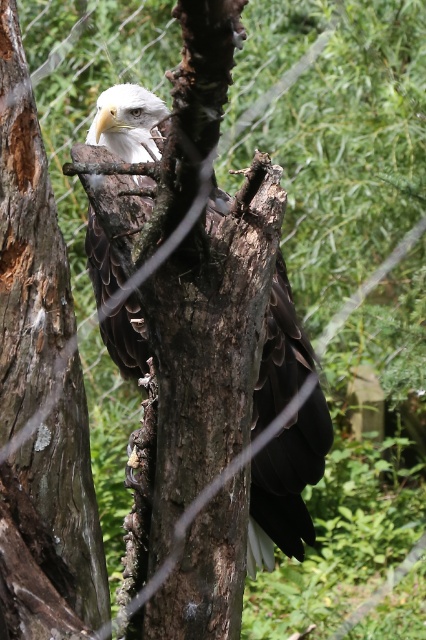
You are a birdwatcher observing a bald eagle in its natural habitat. You notice the brown rough tree trunk at left and the dark brown feathers at center. Which object is taller in the image?

The brown rough tree trunk at left is taller than the dark brown feathers at center.

You are a birdwatcher observing the bald eagle from a distance. You notice the brown rough tree trunk at left and the dark brown feathers at center. Which object is closer to your viewpoint?

Answer: The brown rough tree trunk at left is closer to your viewpoint because it is in front of the dark brown feathers at center.

From the picture: What is the 2D coordinate of the brown rough tree trunk at left in the image?

The brown rough tree trunk at left is located at the 2D coordinate point of (52,528).